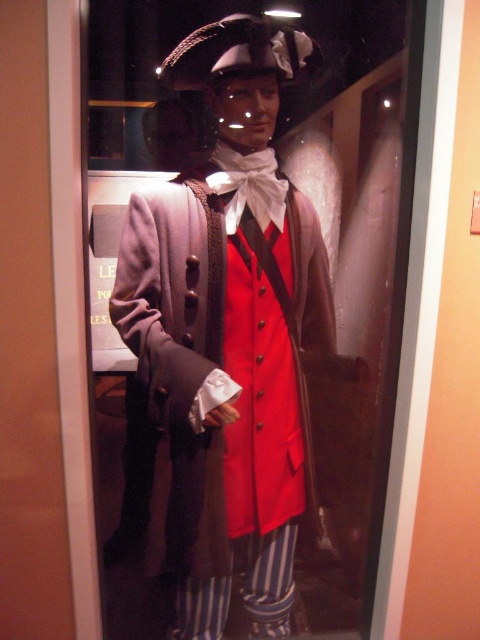
You are a museum visitor who wants to take a photo of the matte brown coat at center and the white satin tie at center. Since the display case has a reflective surface, you need to ensure both items are visible. Based on their positions, which item is more likely to be obscured by the reflection?

The white satin tie at center is more likely to be obscured by the reflection because the matte brown coat at center is positioned on the left side of it, potentially casting a reflection that covers the white satin tie at center.

You are a museum visitor standing in front of the display case. You notice two points on the mannequin, one at point (164, 289) and the other at point (247, 172). Which point appears closer to your eyes?

Point (164, 289) is closer to the camera than point (247, 172), so the point at (164, 289) appears closer to your eyes.